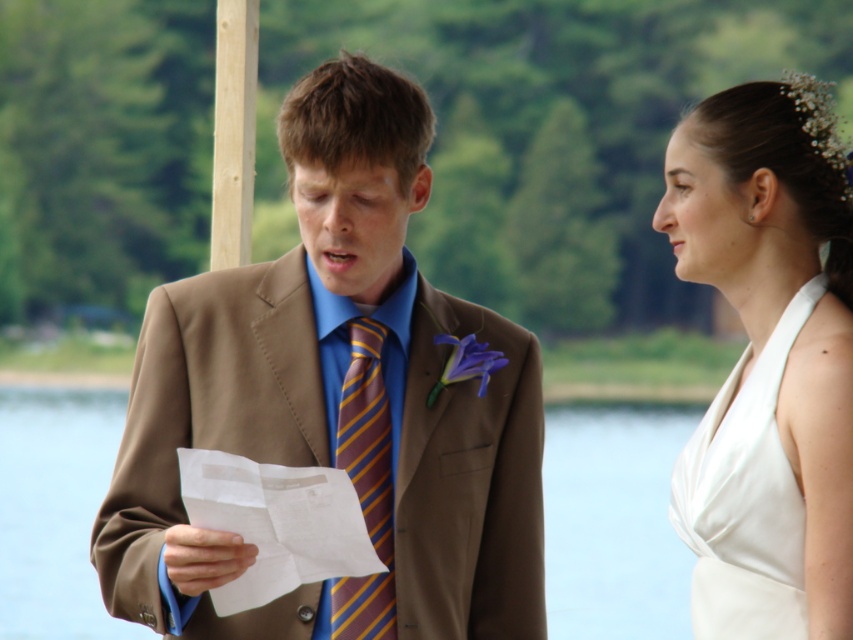
You are a photographer at the wedding and need to adjust the lighting to ensure both the white satin dress at upper right and the white paper at center are clearly visible. Which object should you focus on first to avoid overexposure?

The white satin dress at upper right is above the white paper at center. Since it is positioned higher in the frame, focusing on it first will help balance the exposure between both white objects.

Based on the photo, you are a photographer at the wedding. The couple is standing in front of you. You need to adjust your camera focus to capture both the white paper at center and the striped silk tie at center clearly. Which object should you focus on first to ensure both are in focus?

The white paper at center is below striped silk tie at center. To ensure both are in focus, focus on the striped silk tie at center first since it is farther away, then adjust the focus to the white paper at center if needed.